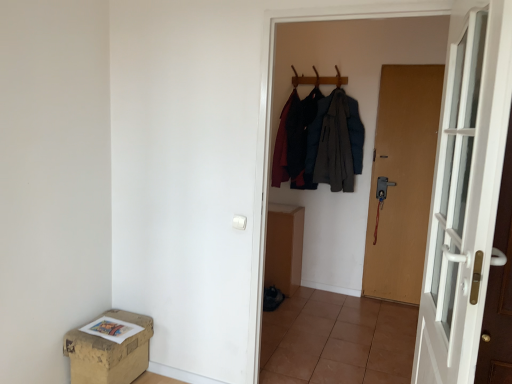
Question: Considering their positions, is wooden coat hanger at upper center located in front of or behind white glass door at right, which ranks as the second door in right-to-left order?

Choices:
 (A) front
 (B) behind

Answer: (B)

Question: Is wooden coat hanger at upper center wider or thinner than white glass door at right, acting as the 1th door starting from the left?

Choices:
 (A) thin
 (B) wide

Answer: (A)

Question: Which of these objects is positioned closest to the brown matte door at right, which is the 1th door from back to front?

Choices:
 (A) brown tile at center
 (B) white glass door at right, placed as the second door when sorted from back to front
 (C) dark gray wool coat at center
 (D) wooden coat hanger at upper center
 (E) brown cardboard box at lower left

Answer: (C)

Question: Estimate the real-world distances between objects in this image. Which object is farther from the brown tile at center?

Choices:
 (A) white glass door at right, placed as the second door when sorted from back to front
 (B) brown matte door at right, the second door positioned from the left
 (C) dark gray wool coat at center
 (D) brown cardboard box at lower left
 (E) wooden coat hanger at upper center

Answer: (E)